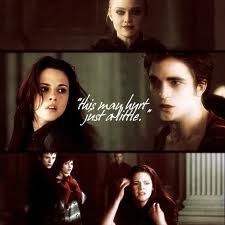
Identify the location of roman style column. (205, 170).